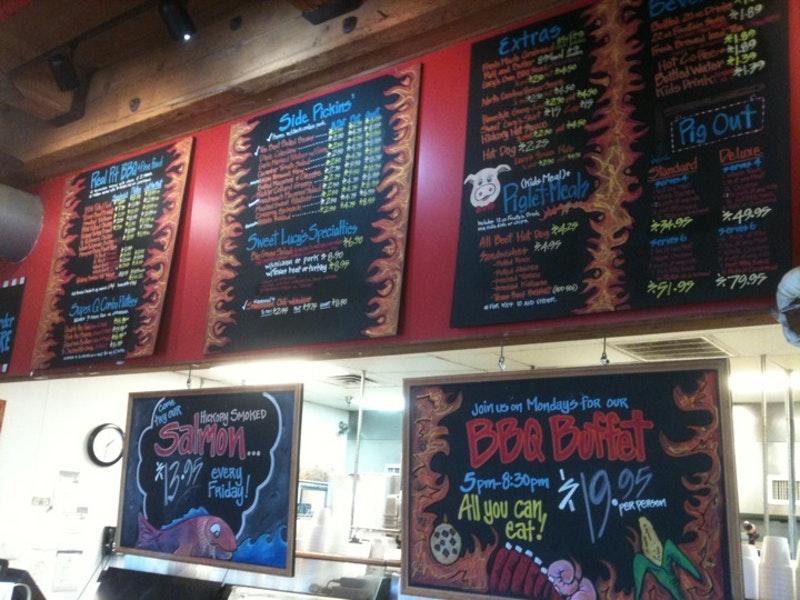
The width and height of the screenshot is (800, 600). I want to click on wooden ceiling, so click(x=80, y=105), click(x=300, y=73).